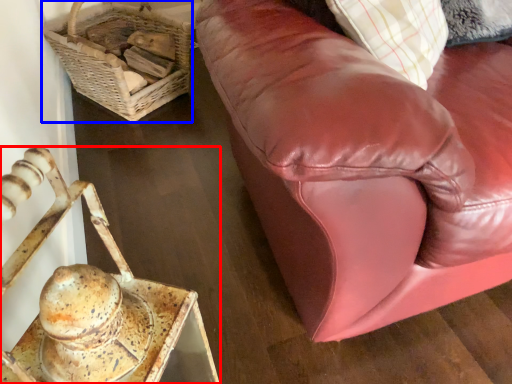
Question: Which object is closer to the camera taking this photo, furniture (highlighted by a red box) or basket (highlighted by a blue box)?

Choices:
 (A) furniture
 (B) basket

Answer: (A)